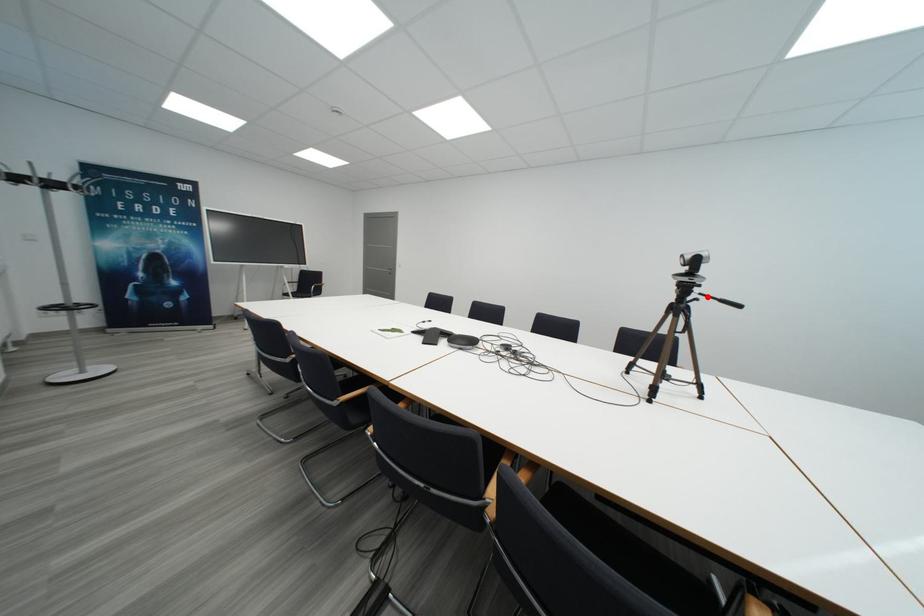
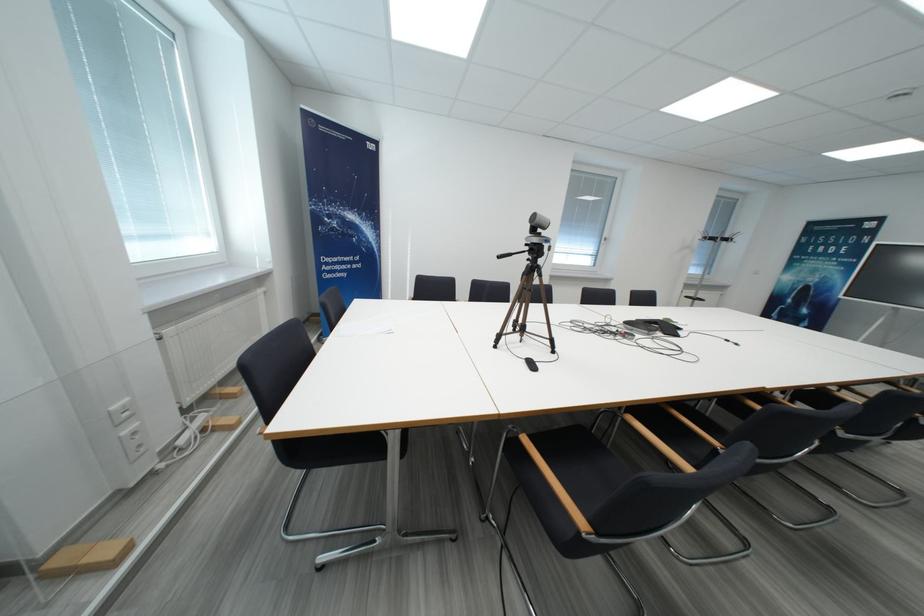
Question: I am providing you with two images of the same scene from different viewpoints. A red point is marked on the first image. At the location where the point appears in image 1, is it still visible in image 2?

Choices:
 (A) Yes
 (B) No

Answer: (A)